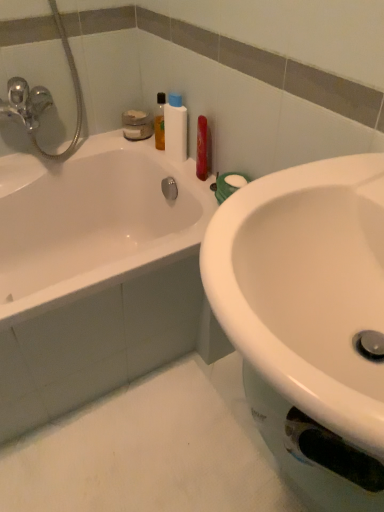
Question: Is white glossy bathtub at upper left shorter than white plastic bottle at upper center?

Choices:
 (A) no
 (B) yes

Answer: (A)

Question: Does white glossy bathtub at upper left lie behind white plastic bottle at upper center?

Choices:
 (A) yes
 (B) no

Answer: (B)

Question: Is white glossy bathtub at upper left looking in the opposite direction of white plastic bottle at upper center?

Choices:
 (A) yes
 (B) no

Answer: (B)

Question: From the image's perspective, is white glossy bathtub at upper left on top of white plastic bottle at upper center?

Choices:
 (A) no
 (B) yes

Answer: (A)

Question: Is white glossy bathtub at upper left positioned in front of white plastic bottle at upper center?

Choices:
 (A) yes
 (B) no

Answer: (A)

Question: Can you confirm if white glossy bathtub at upper left is thinner than white plastic bottle at upper center?

Choices:
 (A) no
 (B) yes

Answer: (A)

Question: Is white glossy sink at center not close to white plastic bottle at upper center?

Choices:
 (A) yes
 (B) no

Answer: (B)

Question: From the image's perspective, is white glossy sink at center on white plastic bottle at upper center?

Choices:
 (A) yes
 (B) no

Answer: (B)

Question: Is white glossy sink at center closer to camera compared to white plastic bottle at upper center?

Choices:
 (A) yes
 (B) no

Answer: (A)

Question: From a real-world perspective, is white glossy sink at center physically above white plastic bottle at upper center?

Choices:
 (A) no
 (B) yes

Answer: (B)

Question: Does white glossy sink at center touch white plastic bottle at upper center?

Choices:
 (A) yes
 (B) no

Answer: (B)

Question: Is white plastic bottle at upper center a part of white glossy sink at center?

Choices:
 (A) yes
 (B) no

Answer: (B)

Question: Can you confirm if white glossy bathtub at upper left is positioned to the left of white glossy sink at center?

Choices:
 (A) yes
 (B) no

Answer: (A)